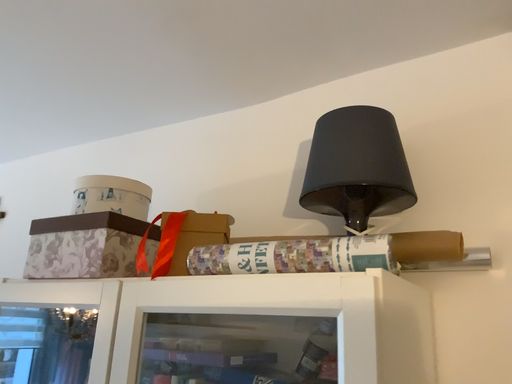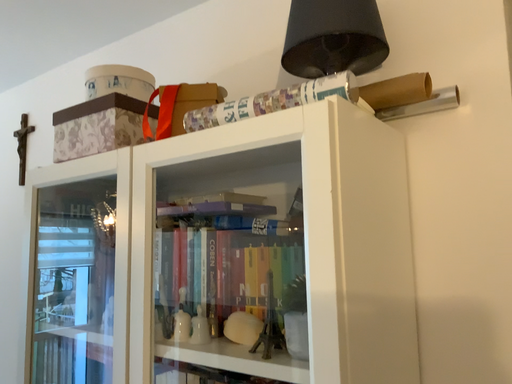
Question: How did the camera likely rotate when shooting the video?

Choices:
 (A) rotated upward
 (B) rotated downward

Answer: (B)